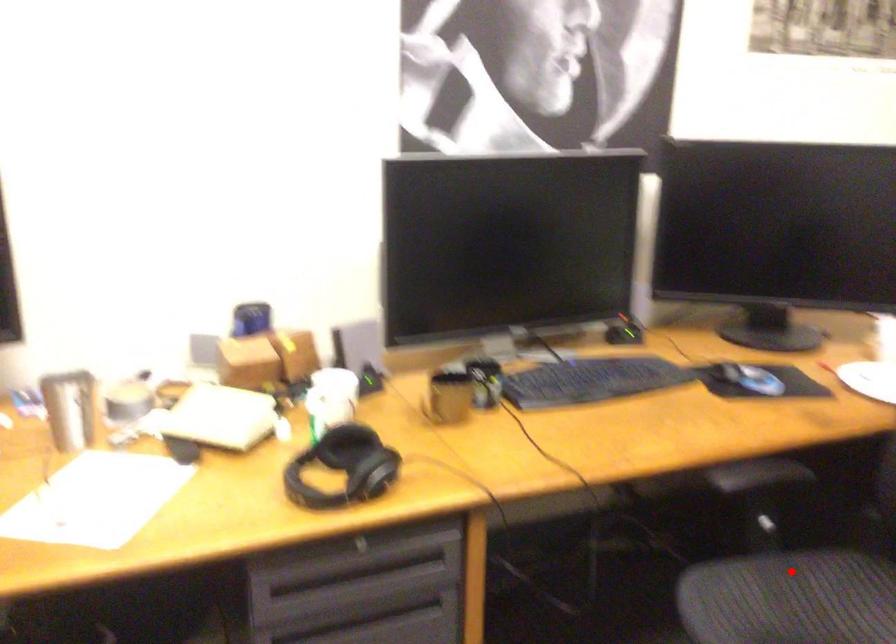
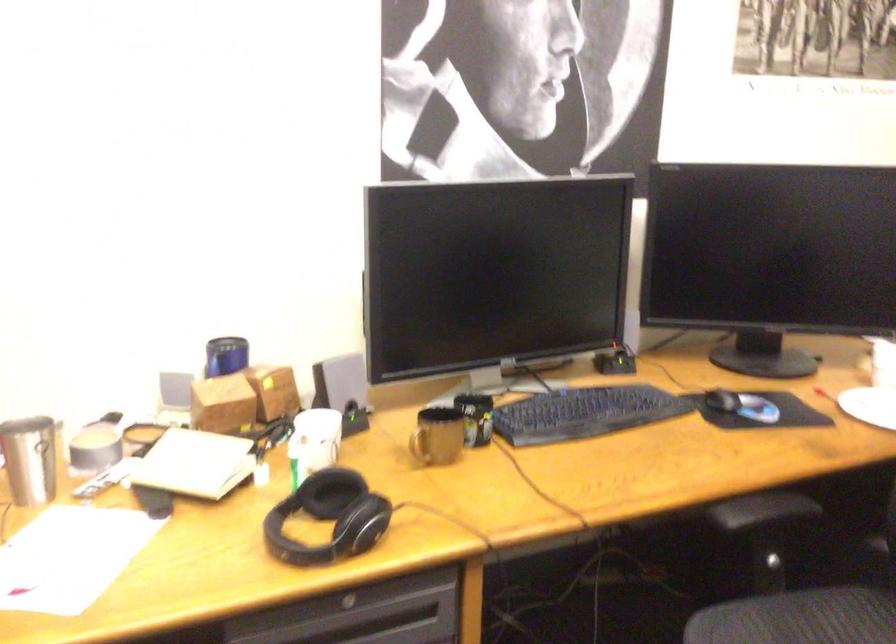
Where in the second image is the point corresponding to the highlighted location from the first image?

(805, 612)